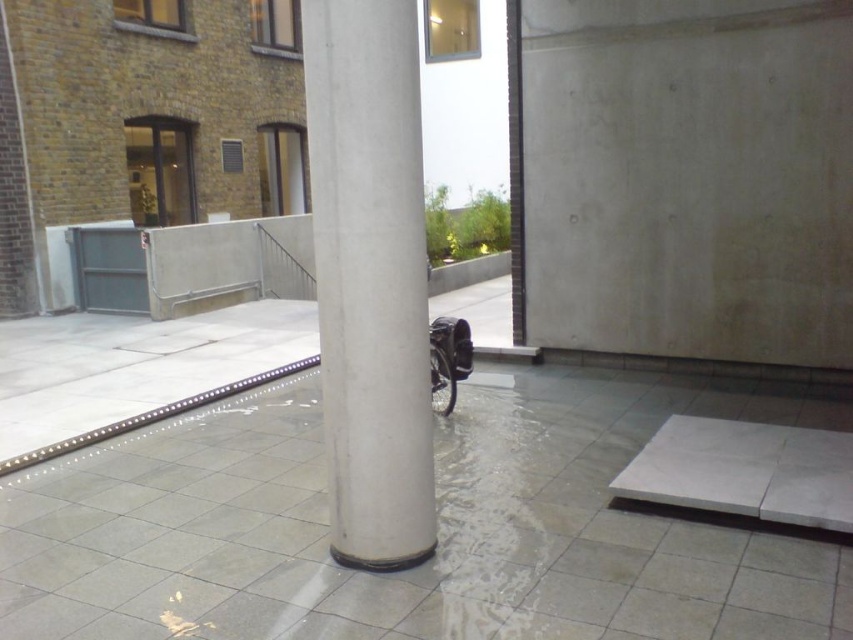
Which is behind, point (368, 74) or point (740, 449)?

The point (740, 449) is behind.

Which is in front, point (428, 397) or point (682, 428)?

Positioned in front is point (428, 397).

What do you see at coordinates (370, 276) in the screenshot?
I see `white smooth concrete pillar at center` at bounding box center [370, 276].

Locate an element on the screen. white smooth concrete pillar at center is located at coordinates (370, 276).